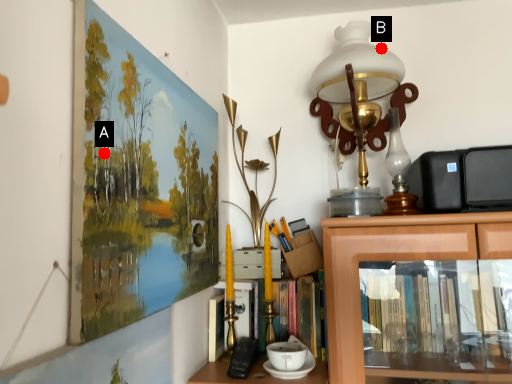
Question: Two points are circled on the image, labeled by A and B beside each circle. Which point is farther to the camera?

Choices:
 (A) A is further
 (B) B is further

Answer: (B)